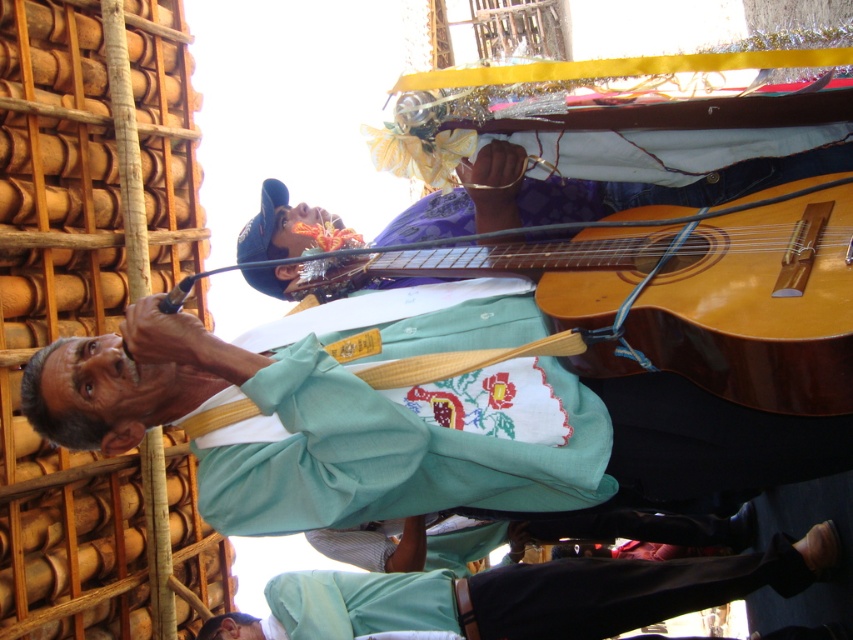
You are a photographer at the event and want to capture a photo where the light brown wood guitar at center is visible above the light blue fabric pants at lower center. Is this possible based on their positions?

Yes, the light brown wood guitar at center is positioned above the light blue fabric pants at lower center, so capturing this arrangement is possible.